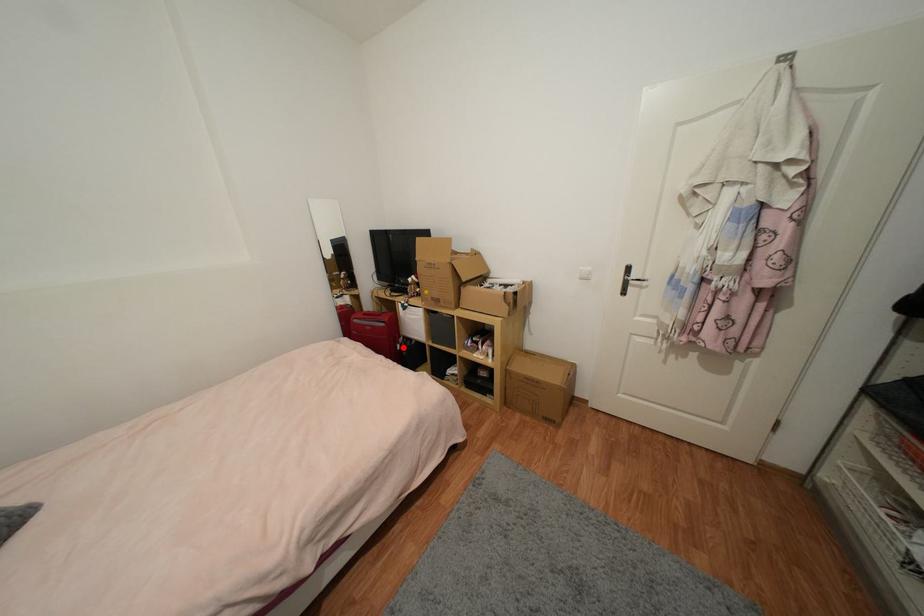
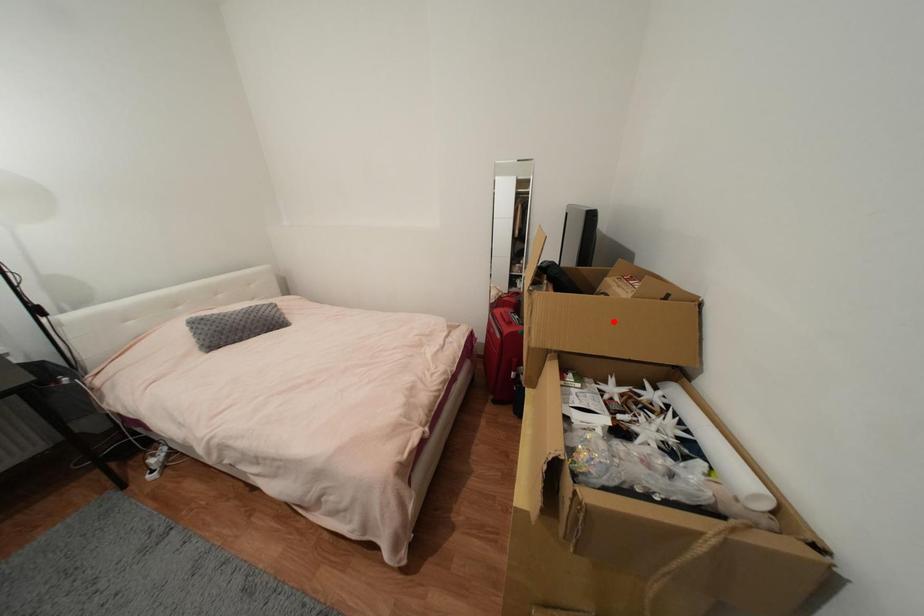
I am providing you with two images of the same scene from different viewpoints. A red point is marked on the first image and another point is marked on the second image. Does the point marked in image1 correspond to the same location as the one in image2?

No